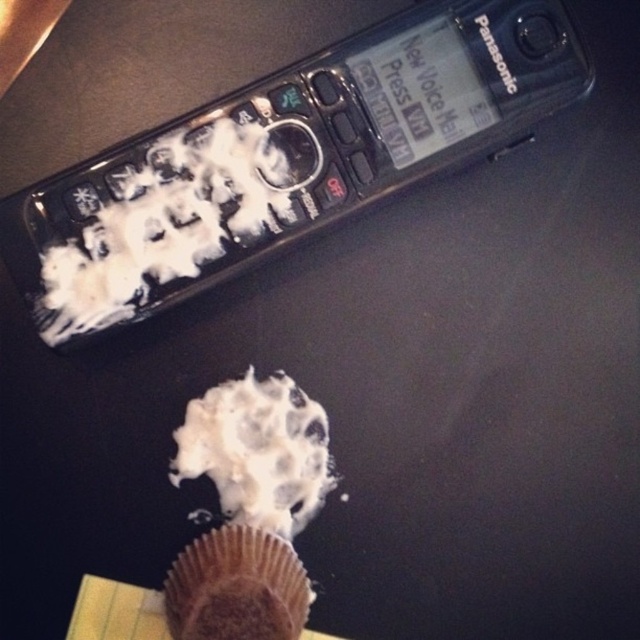
You are a baker who just finished decorating a white creamy frosting at center and a brown matte muffin at lower center. You need to place them in an oven tray. Which one should you place first to avoid covering the other?

The brown matte muffin at lower center should be placed first in the oven tray because it is behind the white creamy frosting at center, so placing it first will prevent the white creamy frosting from being covered when placing the latter on top.

What is the location of the point with coordinates (257, 451) in the image?

The point with coordinates (257, 451) is located on the white creamy frosting at center.